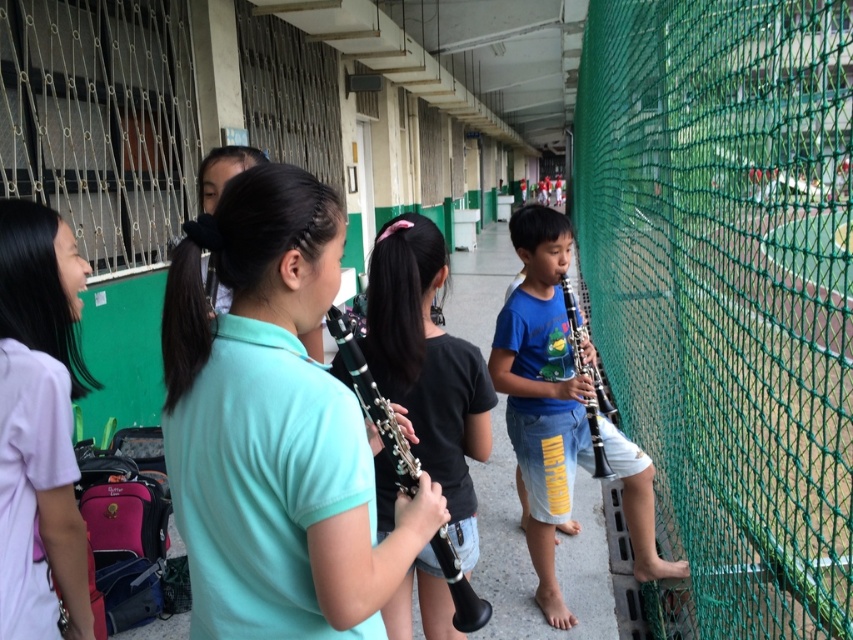
You are a music teacher who needs to pass a sheet of paper to the student holding the light purple cotton shirt at left from the position of the teal matte clarinet at center. Can you hand the paper directly without needing to move either object?

The distance between the teal matte clarinet at center and the light purple cotton shirt at left is 56.69 centimeters, so yes, you can hand the paper directly without needing to move either object.

You are a music teacher trying to arrange the instruments for a performance. The blue matte hautboy at right and the black plastic clarinet at center are both on stage. If the stage is only 4 feet wide, will both instruments fit side by side without overlapping?

The blue matte hautboy at right is 4.36 feet from the black plastic clarinet at center. Since the stage is only 4 feet wide, the total distance between them exceeds the stage width, so they cannot fit side by side without overlapping.

You are a music teacher organizing an outdoor practice session. You have two instruments, the blue matte hautboy at right and the black plastic clarinet at center. Which instrument is taller?

The blue matte hautboy at right is much taller than the black plastic clarinet at center.